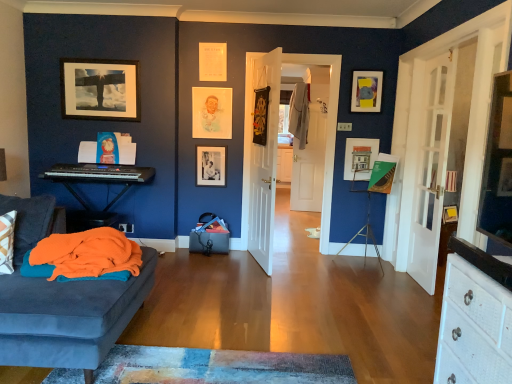
Locate an element on the screen. black plastic keyboard at left is located at coordinates (99, 173).

Describe the element at coordinates (431, 170) in the screenshot. I see `white glass door at right, the 1th door from the right` at that location.

You are a GUI agent. You are given a task and a screenshot of the screen. Output one action in this format:
    pyautogui.click(x=<x>, y=<y>)
    Task: Click on the black matte picture frame at center, which ranks as the fourth picture frame in right-to-left order
    
    Given the screenshot: What is the action you would take?
    pyautogui.click(x=210, y=166)

Measure the distance between matte white picture frame at center, which appears as the 2th picture frame when viewed from the right, and camera.

matte white picture frame at center, which appears as the 2th picture frame when viewed from the right, and camera are 4.28 meters apart from each other.

Identify the location of matte black keyboard at left. (98, 182).

Is matte black picture frame at upper left, the first picture frame in the left-to-right sequence, next to black matte picture frame at center, which ranks as the fourth picture frame in right-to-left order?

No, matte black picture frame at upper left, the first picture frame in the left-to-right sequence, is not beside black matte picture frame at center, which ranks as the fourth picture frame in right-to-left order.

Is matte black picture frame at upper left, which is the 5th picture frame in right-to-left order, wider than black matte picture frame at center, positioned as the second picture frame in left-to-right order?

Indeed, matte black picture frame at upper left, which is the 5th picture frame in right-to-left order, has a greater width compared to black matte picture frame at center, positioned as the second picture frame in left-to-right order.

Locate an element on the screen. the 4th picture frame behind when counting from the matte black picture frame at upper left, which is the 5th picture frame in right-to-left order is located at coordinates (210, 166).

Between matte black picture frame at upper left, the first picture frame in the left-to-right sequence, and black matte picture frame at center, which ranks as the fourth picture frame in right-to-left order, which one has smaller size?

With smaller size is black matte picture frame at center, which ranks as the fourth picture frame in right-to-left order.

Is matte black keyboard at left bigger than matte black picture frame at upper left, the first picture frame in the left-to-right sequence?

Yes, matte black keyboard at left is bigger than matte black picture frame at upper left, the first picture frame in the left-to-right sequence.

Which is more to the left, matte black keyboard at left or matte black picture frame at upper left, the first picture frame in the left-to-right sequence?

From the viewer's perspective, matte black picture frame at upper left, the first picture frame in the left-to-right sequence, appears more on the left side.

Is matte black keyboard at left turned away from matte black picture frame at upper left, which is the 5th picture frame in right-to-left order?

No.

How many degrees apart are the facing directions of matte black keyboard at left and matte black picture frame at upper left, the first picture frame in the left-to-right sequence?

4.71 degrees separate the facing orientations of matte black keyboard at left and matte black picture frame at upper left, the first picture frame in the left-to-right sequence.

Is point (267, 203) closer to viewer compared to point (66, 86)?

Yes, it is in front of point (66, 86).

Is matte black picture frame at upper left, which is the 5th picture frame in right-to-left order, surrounded by white wooden door at center, the 1th door positioned from the left?

No, matte black picture frame at upper left, which is the 5th picture frame in right-to-left order, is not inside white wooden door at center, the 1th door positioned from the left.

Can you confirm if white wooden door at center, the second door from the right, is smaller than matte black picture frame at upper left, the first picture frame in the left-to-right sequence?

No, white wooden door at center, the second door from the right, is not smaller than matte black picture frame at upper left, the first picture frame in the left-to-right sequence.

Is matte white picture frame at center, which appears as the 2th picture frame when viewed from the right, at the left side of white wooden door at center, the 1th door positioned from the left?

No.

Which is farther, [353,140] or [268,199]?

The point [353,140] is more distant.

Considering the sizes of objects matte white picture frame at center, which appears as the 2th picture frame when viewed from the right, and white wooden door at center, the 1th door positioned from the left, in the image provided, who is thinner, matte white picture frame at center, which appears as the 2th picture frame when viewed from the right, or white wooden door at center, the 1th door positioned from the left,?

matte white picture frame at center, which appears as the 2th picture frame when viewed from the right.

Does matte black keyboard at left turn towards white wooden door at center, the second door from the right?

No, matte black keyboard at left is not turned towards white wooden door at center, the second door from the right.

In the scene shown: Which of these two, matte black keyboard at left or white wooden door at center, the 1th door positioned from the left, stands shorter?

Standing shorter between the two is matte black keyboard at left.

Find the location of a particular element. computer desk that appears below the white wooden door at center, the second door from the right (from a real-world perspective) is located at coordinates click(x=98, y=182).

Could you measure the distance between white glass door at right, placed as the 2th door when sorted from left to right, and matte paper portrait at upper center, the 3th picture frame in the right-to-left sequence?

They are 6.57 feet apart.

Is white glass door at right, the 1th door from the right, further to camera compared to matte paper portrait at upper center, the third picture frame positioned from the left?

No.

Which object is positioned more to the right, white glass door at right, the 1th door from the right, or matte paper portrait at upper center, the 3th picture frame in the right-to-left sequence?

white glass door at right, the 1th door from the right.

Does white glass door at right, the 1th door from the right, turn towards matte paper portrait at upper center, the 3th picture frame in the right-to-left sequence?

No, white glass door at right, the 1th door from the right, is not aimed at matte paper portrait at upper center, the 3th picture frame in the right-to-left sequence.

Measure the distance between white glass door at right, placed as the 2th door when sorted from left to right, and black plastic keyboard at left.

white glass door at right, placed as the 2th door when sorted from left to right, is 2.74 meters away from black plastic keyboard at left.

From the picture: Can you confirm if white glass door at right, the 1th door from the right, is thinner than black plastic keyboard at left?

Indeed, white glass door at right, the 1th door from the right, has a lesser width compared to black plastic keyboard at left.

From a real-world perspective, which is physically above, white glass door at right, placed as the 2th door when sorted from left to right, or black plastic keyboard at left?

white glass door at right, placed as the 2th door when sorted from left to right, from a real-world perspective.

Does white glass door at right, the 1th door from the right, turn towards black plastic keyboard at left?

Yes, white glass door at right, the 1th door from the right, is aimed at black plastic keyboard at left.

Locate an element on the screen. The image size is (512, 384). the 4th picture frame in front of the black matte picture frame at center, which ranks as the fourth picture frame in right-to-left order is located at coordinates (100, 89).

Identify the location of computer desk that is on the right side of matte black picture frame at upper left, which is the 5th picture frame in right-to-left order. This screenshot has width=512, height=384. (98, 182).

Estimate the real-world distances between objects in this image. Which object is further from matte black picture frame at upper left, the first picture frame in the left-to-right sequence, white wooden door at center, the 1th door positioned from the left, or matte black keyboard at left?

white wooden door at center, the 1th door positioned from the left, is further to matte black picture frame at upper left, the first picture frame in the left-to-right sequence.

When comparing their distances from matte black picture frame at upper left, the first picture frame in the left-to-right sequence, does black plastic keyboard at left or white wooden door at center, the 1th door positioned from the left, seem closer?

black plastic keyboard at left is closer to matte black picture frame at upper left, the first picture frame in the left-to-right sequence.

Estimate the real-world distances between objects in this image. Which object is further from white wooden door at center, the second door from the right, matte yellow and gray picture frame at upper right, marked as the fifth picture frame in a left-to-right arrangement, or matte black keyboard at left?

matte black keyboard at left is positioned further to the anchor white wooden door at center, the second door from the right.

Considering their positions, is black matte picture frame at center, positioned as the second picture frame in left-to-right order, positioned closer to matte white picture frame at center, the fourth picture frame from the left, than matte black keyboard at left?

Among the two, black matte picture frame at center, positioned as the second picture frame in left-to-right order, is located nearer to matte white picture frame at center, the fourth picture frame from the left.

Based on their spatial positions, is matte white picture frame at center, which appears as the 2th picture frame when viewed from the right, or black plastic keyboard at left further from white glass door at right, the 1th door from the right?

black plastic keyboard at left is positioned further to the anchor white glass door at right, the 1th door from the right.

Based on their spatial positions, is white wooden door at center, the 1th door positioned from the left, or matte paper portrait at upper center, the 3th picture frame in the right-to-left sequence, closer to matte black keyboard at left?

matte paper portrait at upper center, the 3th picture frame in the right-to-left sequence.

Considering their positions, is black matte picture frame at center, which ranks as the fourth picture frame in right-to-left order, positioned further to matte black picture frame at upper left, the first picture frame in the left-to-right sequence, than black plastic keyboard at left?

Result: Among the two, black matte picture frame at center, which ranks as the fourth picture frame in right-to-left order, is located further to matte black picture frame at upper left, the first picture frame in the left-to-right sequence.

Based on their spatial positions, is black plastic keyboard at left or black matte picture frame at center, positioned as the second picture frame in left-to-right order, closer to matte black picture frame at upper left, the first picture frame in the left-to-right sequence?

black plastic keyboard at left is positioned closer to the anchor matte black picture frame at upper left, the first picture frame in the left-to-right sequence.

Find the location of `musical keyboard between matte black picture frame at upper left, the first picture frame in the left-to-right sequence, and white glass door at right, placed as the 2th door when sorted from left to right, in the horizontal direction`. musical keyboard between matte black picture frame at upper left, the first picture frame in the left-to-right sequence, and white glass door at right, placed as the 2th door when sorted from left to right, in the horizontal direction is located at coordinates (99, 173).

Locate an element on the screen. This screenshot has width=512, height=384. computer desk located between matte black picture frame at upper left, the first picture frame in the left-to-right sequence, and white wooden door at center, the second door from the right, in the left-right direction is located at coordinates click(98, 182).

Find the location of a particular element. The image size is (512, 384). door between matte paper portrait at upper center, the 3th picture frame in the right-to-left sequence, and matte white picture frame at center, the fourth picture frame from the left, in the horizontal direction is located at coordinates (264, 162).

I want to click on door between matte black picture frame at upper left, which is the 5th picture frame in right-to-left order, and matte white picture frame at center, the fourth picture frame from the left, so click(264, 162).